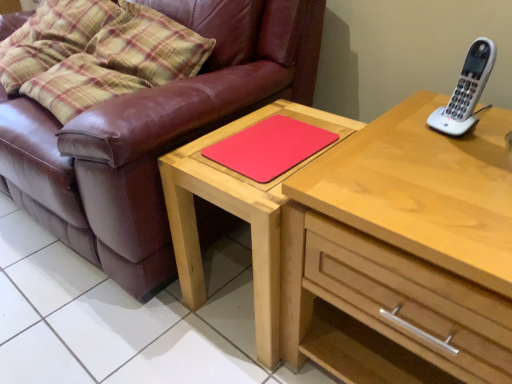
Question: Considering the relative sizes of light wood chest of drawers at upper right and matte wooden table at center in the image provided, is light wood chest of drawers at upper right smaller than matte wooden table at center?

Choices:
 (A) no
 (B) yes

Answer: (A)

Question: Does light wood chest of drawers at upper right come in front of matte wooden table at center?

Choices:
 (A) yes
 (B) no

Answer: (A)

Question: Is the depth of light wood chest of drawers at upper right greater than that of matte wooden table at center?

Choices:
 (A) yes
 (B) no

Answer: (B)

Question: Is light wood chest of drawers at upper right shorter than matte wooden table at center?

Choices:
 (A) yes
 (B) no

Answer: (B)

Question: Is light wood chest of drawers at upper right wider than matte wooden table at center?

Choices:
 (A) yes
 (B) no

Answer: (A)

Question: Is light wood chest of drawers at upper right to the left of matte wooden table at center from the viewer's perspective?

Choices:
 (A) yes
 (B) no

Answer: (B)

Question: From a real-world perspective, is white plastic phone at upper right physically below rubberized red mousepad at center?

Choices:
 (A) yes
 (B) no

Answer: (B)

Question: Is white plastic phone at upper right aimed at rubberized red mousepad at center?

Choices:
 (A) no
 (B) yes

Answer: (A)

Question: Is white plastic phone at upper right located outside rubberized red mousepad at center?

Choices:
 (A) yes
 (B) no

Answer: (A)

Question: Is white plastic phone at upper right wider than rubberized red mousepad at center?

Choices:
 (A) no
 (B) yes

Answer: (A)

Question: From the image's perspective, is white plastic phone at upper right located beneath rubberized red mousepad at center?

Choices:
 (A) no
 (B) yes

Answer: (A)

Question: Is white plastic phone at upper right smaller than rubberized red mousepad at center?

Choices:
 (A) yes
 (B) no

Answer: (A)

Question: From the image's perspective, would you say white plastic phone at upper right is positioned over matte wooden table at center?

Choices:
 (A) yes
 (B) no

Answer: (A)